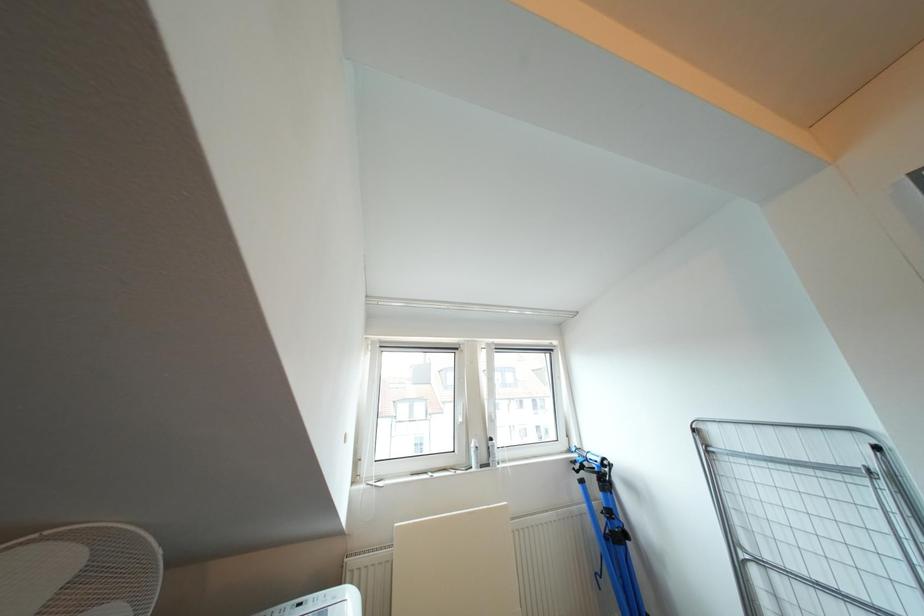
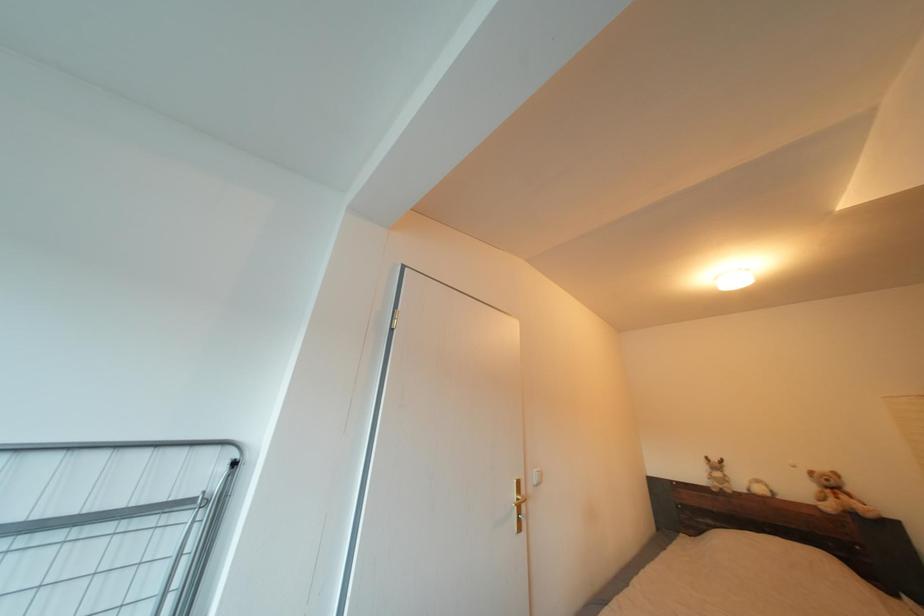
Consider the image. The first image is from the beginning of the video and the second image is from the end. How did the camera likely rotate when shooting the video?

The camera rotated toward right-up.